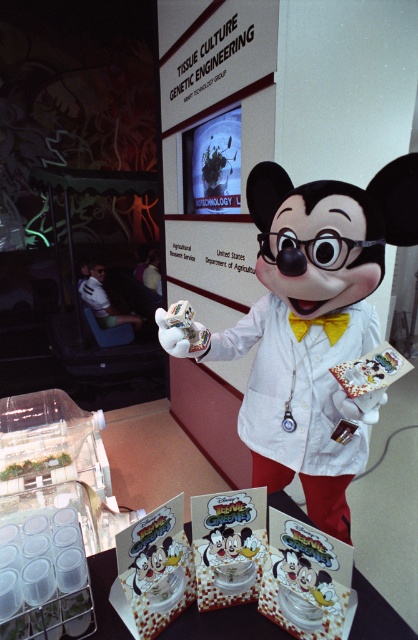
You are a guest at the event and want to take a photo of the white glossy mickey mouse at center and the white glossy plush at center. Which one should you focus on first to ensure both are in the frame?

You should focus on the white glossy mickey mouse at center first because it is closer to you than the white glossy plush at center, ensuring both are in the frame.